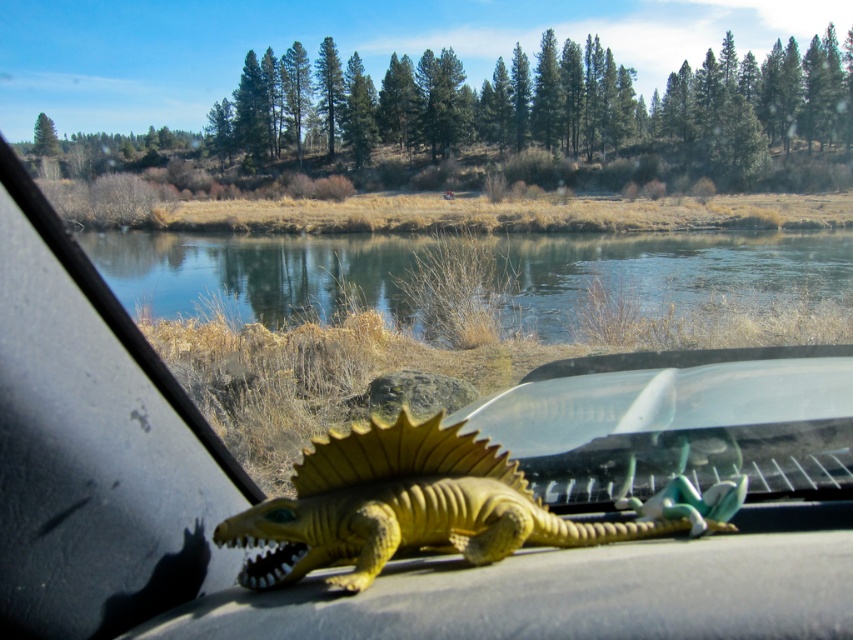
Who is positioned more to the left, clear blue water at center or yellow matte plastic dinosaur at center?

Positioned to the left is clear blue water at center.

Looking at this image, measure the distance between clear blue water at center and yellow matte plastic dinosaur at center.

clear blue water at center and yellow matte plastic dinosaur at center are 19.68 meters apart.

Between point (833, 234) and point (289, 504), which one is positioned behind?

The point (833, 234) is more distant.

I want to click on clear blue water at center, so click(672, 275).